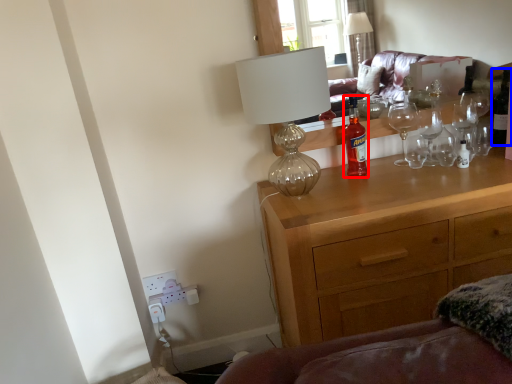
Question: Among these objects, which one is nearest to the camera, bottle (highlighted by a red box) or wine bottle (highlighted by a blue box)?

Choices:
 (A) bottle
 (B) wine bottle

Answer: (A)